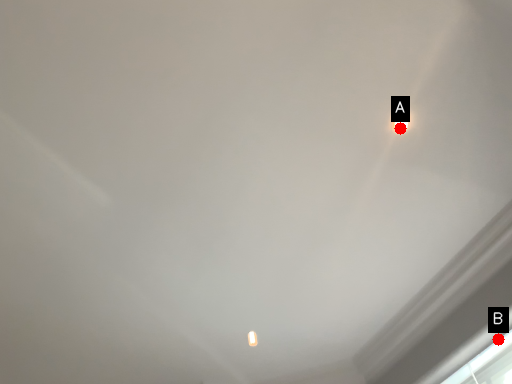
Question: Two points are circled on the image, labeled by A and B beside each circle. Which point appears closest to the camera in this image?

Choices:
 (A) A is closer
 (B) B is closer

Answer: (A)